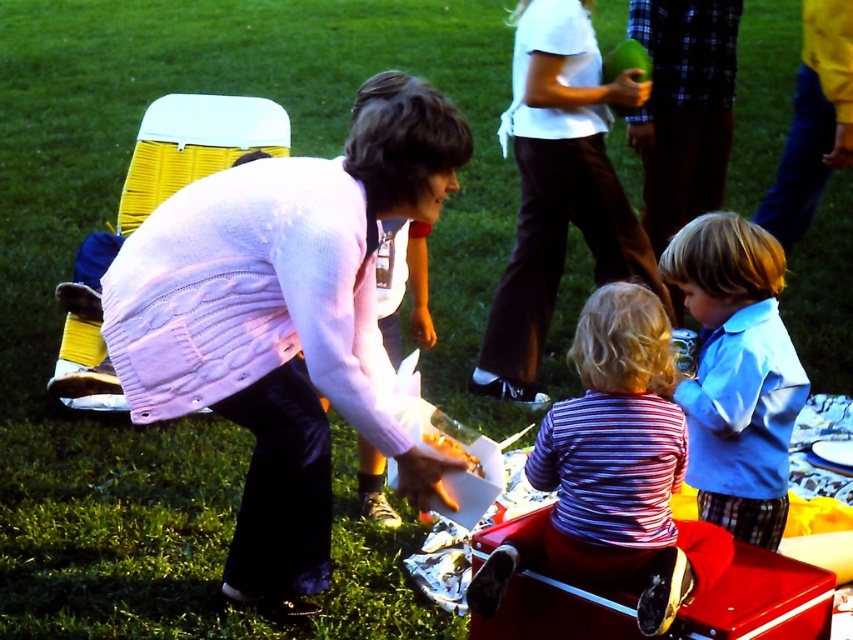
Question: Does pink knit sweater at center have a larger size compared to white cotton shirt at upper center?

Choices:
 (A) yes
 (B) no

Answer: (A)

Question: Observing the image, what is the correct spatial positioning of blue satin shirt at right in reference to plaid fabric pants at right?

Choices:
 (A) above
 (B) below

Answer: (B)

Question: Does pink knit sweater at center have a smaller size compared to plaid fabric pants at right?

Choices:
 (A) yes
 (B) no

Answer: (B)

Question: Based on their relative distances, which object is farther from the pink knit sweater at center?

Choices:
 (A) white cotton shirt at upper center
 (B) plaid fabric pants at right

Answer: (B)

Question: Estimate the real-world distances between objects in this image. Which object is closer to the plaid fabric pants at right?

Choices:
 (A) striped cotton shirt at center
 (B) white cotton shirt at upper center
 (C) yellow matte food at lower center
 (D) pink knit sweater at center

Answer: (B)

Question: Which point appears farthest from the camera in this image?

Choices:
 (A) (682, 138)
 (B) (560, 429)

Answer: (A)